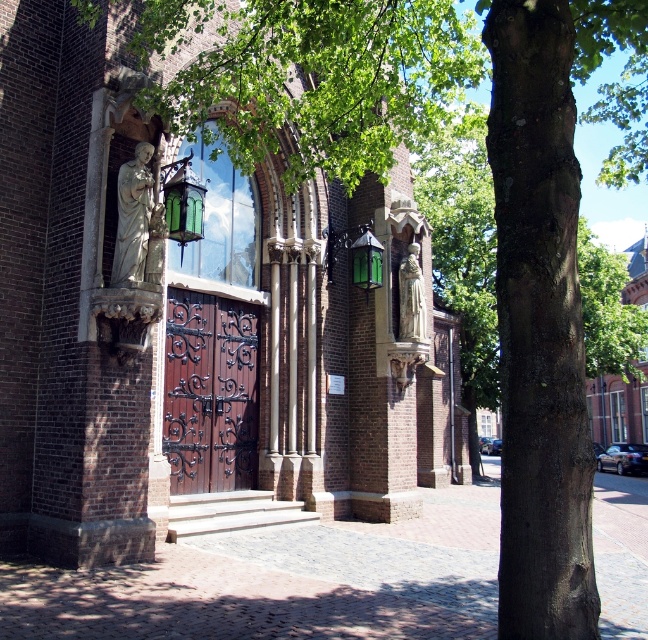
Which of these two, brick pavement at center or white marble statue at left, stands shorter?

white marble statue at left is shorter.

Does point (14, 592) lie in front of point (141, 150)?

Yes, point (14, 592) is closer to viewer.

Between point (262, 628) and point (119, 221), which one is positioned behind?

The point (119, 221) is behind.

Locate an element on the screen. brick pavement at center is located at coordinates (283, 580).

Who is more distant from viewer, [189,308] or [627,291]?

Point [627,291]

Locate an element on the screen. dark wood wrought iron door at center is located at coordinates (211, 392).

Can you confirm if brick church at center is positioned below dark wood wrought iron door at center?

Actually, brick church at center is above dark wood wrought iron door at center.

Can you confirm if brick church at center is positioned above dark wood wrought iron door at center?

Yes, brick church at center is above dark wood wrought iron door at center.

Who is more distant from viewer, (x=227, y=193) or (x=181, y=416)?

The point (x=227, y=193) is behind.

Where is `brick church at center`? This screenshot has width=648, height=640. brick church at center is located at coordinates (189, 324).